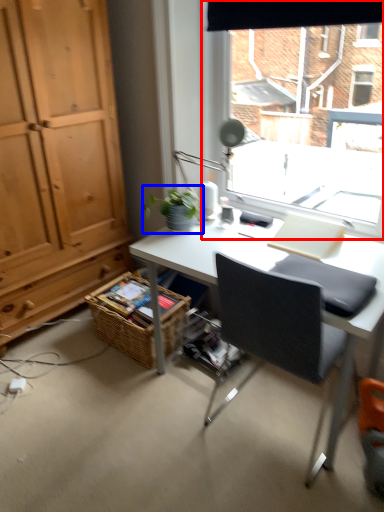
Question: Which of the following is the closest to the observer, window (highlighted by a red box) or houseplant (highlighted by a blue box)?

Choices:
 (A) window
 (B) houseplant

Answer: (A)